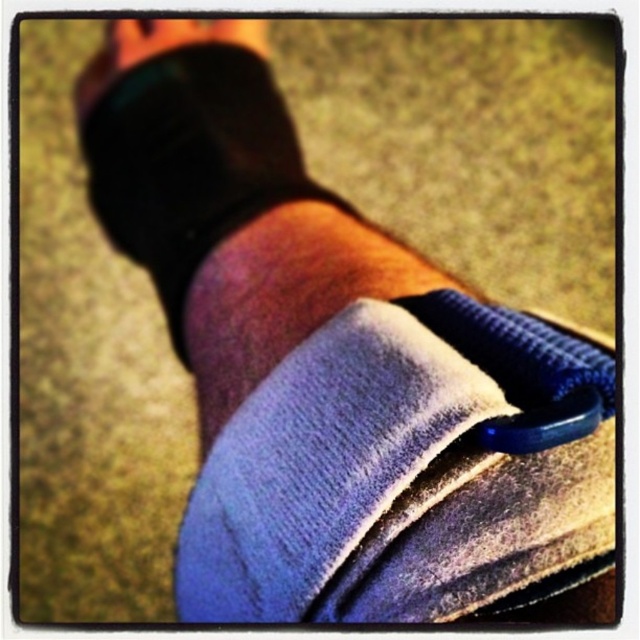
Who is positioned more to the right, velvet blue strap at center or matte black toe at upper center?

velvet blue strap at center

Between velvet blue strap at center and matte black toe at upper center, which one is positioned higher?

matte black toe at upper center is above.

Who is more distant from viewer, (x=513, y=433) or (x=115, y=48)?

The point (x=115, y=48) is more distant.

What are the coordinates of `velvet blue strap at center` in the screenshot? It's located at (524, 369).

Is blue velvety sock at center to the right of matte black toe at upper center from the viewer's perspective?

Indeed, blue velvety sock at center is positioned on the right side of matte black toe at upper center.

Is blue velvety sock at center bigger than matte black toe at upper center?

Yes, blue velvety sock at center is bigger than matte black toe at upper center.

Which is behind, point (202, 573) or point (138, 35)?

The point (138, 35) is behind.

At what (x,y) coordinates should I click in order to perform the action: click on blue velvety sock at center. Please return your answer as a coordinate pair (x, y). This screenshot has height=640, width=640. Looking at the image, I should click on (320, 461).

What do you see at coordinates (320, 461) in the screenshot? The height and width of the screenshot is (640, 640). I see `blue velvety sock at center` at bounding box center [320, 461].

Between blue velvety sock at center and velvet blue strap at center, which one is positioned higher?

velvet blue strap at center

Between point (468, 416) and point (580, 381), which one is positioned behind?

Positioned behind is point (580, 381).

Where is `blue velvety sock at center`? The height and width of the screenshot is (640, 640). blue velvety sock at center is located at coordinates [320, 461].